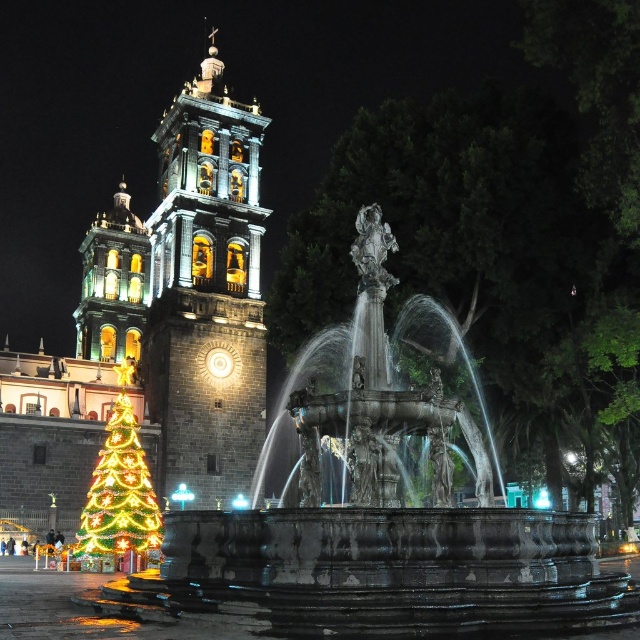
Between matte gray church at center and illuminated plastic christmas tree at lower left, which one is positioned lower?

Positioned lower is illuminated plastic christmas tree at lower left.

Is point (26, 497) positioned behind point (122, 500)?

That is True.

Locate an element on the screen. matte gray church at center is located at coordinates (x=157, y=326).

Is polished stone fountain at center thinner than illuminated plastic christmas tree at lower left?

No.

Measure the distance between polished stone fountain at center and camera.

polished stone fountain at center is 39.86 meters away from camera.

Locate an element on the screen. Image resolution: width=640 pixels, height=640 pixels. polished stone fountain at center is located at coordinates (380, 529).

Does polished stone fountain at center appear over matte gray church at center?

Answer: No, polished stone fountain at center is not above matte gray church at center.

What do you see at coordinates (380, 529) in the screenshot? The width and height of the screenshot is (640, 640). I see `polished stone fountain at center` at bounding box center [380, 529].

The image size is (640, 640). Identify the location of polished stone fountain at center. (380, 529).